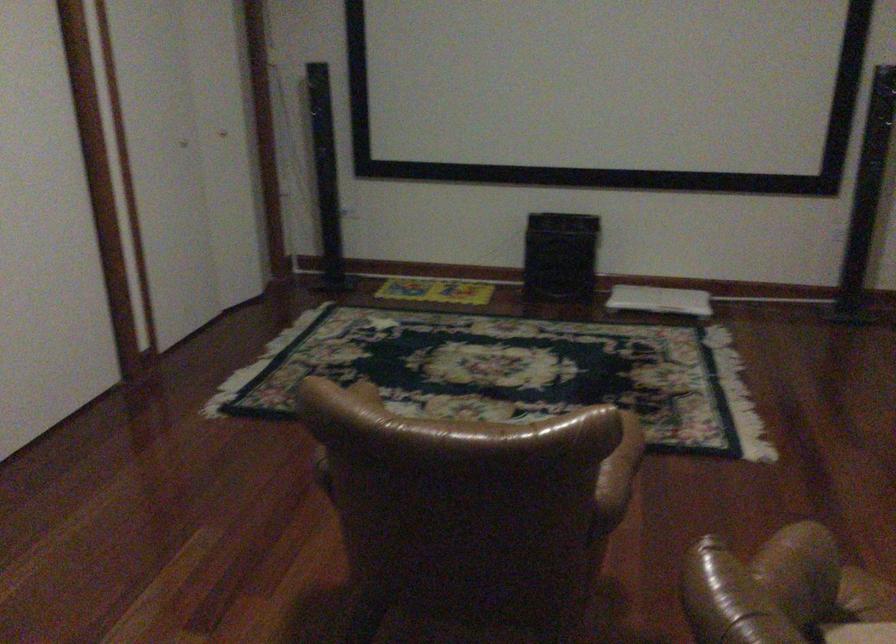
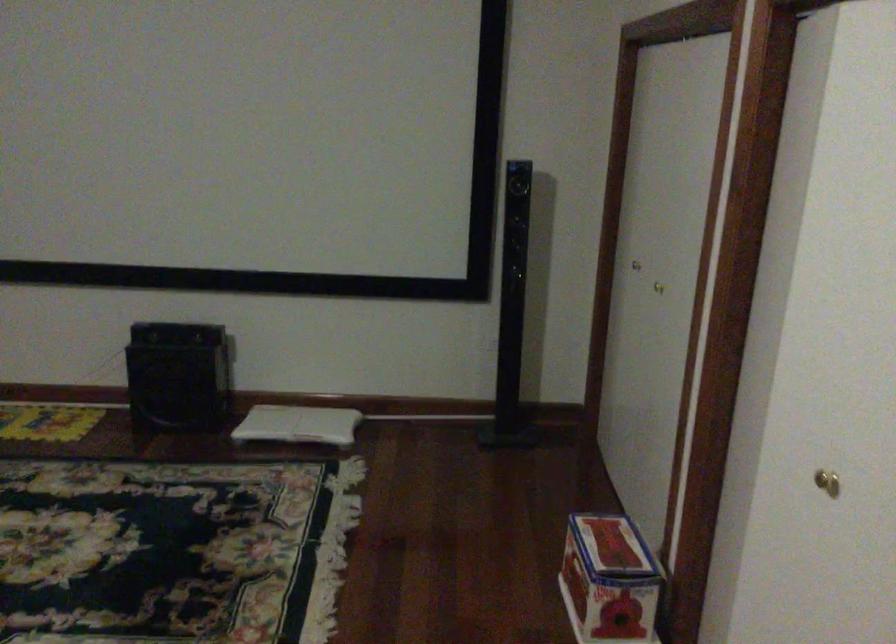
In a continuous first-person perspective shot, in which direction is the camera moving?

The movement direction of the cameraman is right, forward.